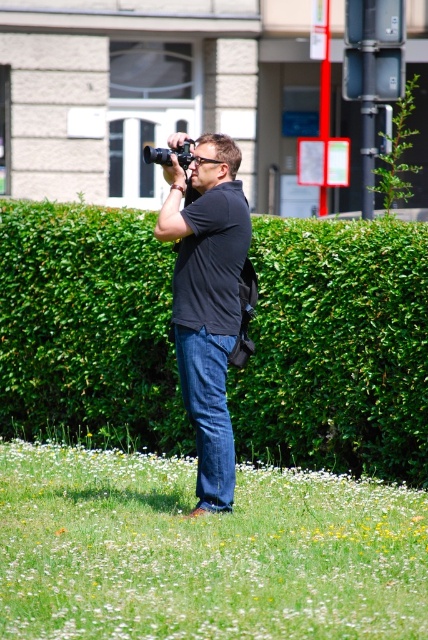
Is point (374, 541) in front of point (157, 160)?

Yes.

Does green grass at lower center come behind black plastic camera at center?

No.

Locate an element on the screen. The width and height of the screenshot is (428, 640). green grass at lower center is located at coordinates click(202, 552).

The width and height of the screenshot is (428, 640). Identify the location of green grass at lower center. (202, 552).

Between green leafy hedge at center and black plastic camera at center, which one has more height?

With more height is black plastic camera at center.

Can you confirm if green leafy hedge at center is positioned above black plastic camera at center?

Actually, green leafy hedge at center is below black plastic camera at center.

Does point (333, 360) lie in front of point (142, 148)?

Yes, it is in front of point (142, 148).

Where is `green leafy hedge at center`? This screenshot has height=640, width=428. green leafy hedge at center is located at coordinates (336, 348).

Can you confirm if green grass at lower center is bigger than black matte shirt at center?

Incorrect, green grass at lower center is not larger than black matte shirt at center.

Is green grass at lower center wider than black matte shirt at center?

Indeed, green grass at lower center has a greater width compared to black matte shirt at center.

Which is behind, point (130, 547) or point (235, 170)?

Positioned behind is point (235, 170).

The height and width of the screenshot is (640, 428). What are the coordinates of `green grass at lower center` in the screenshot? It's located at (202, 552).